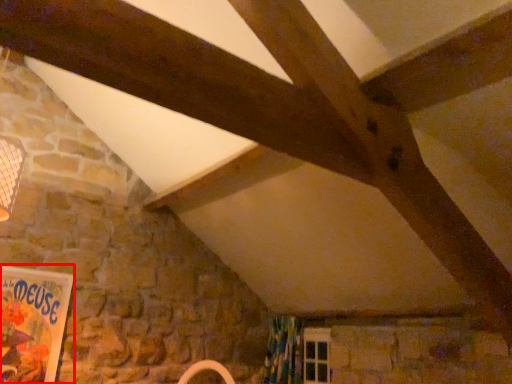
Question: From the image, what is the correct spatial relationship of bulletin board (annotated by the red box) in relation to curtain?

Choices:
 (A) right
 (B) left

Answer: (B)